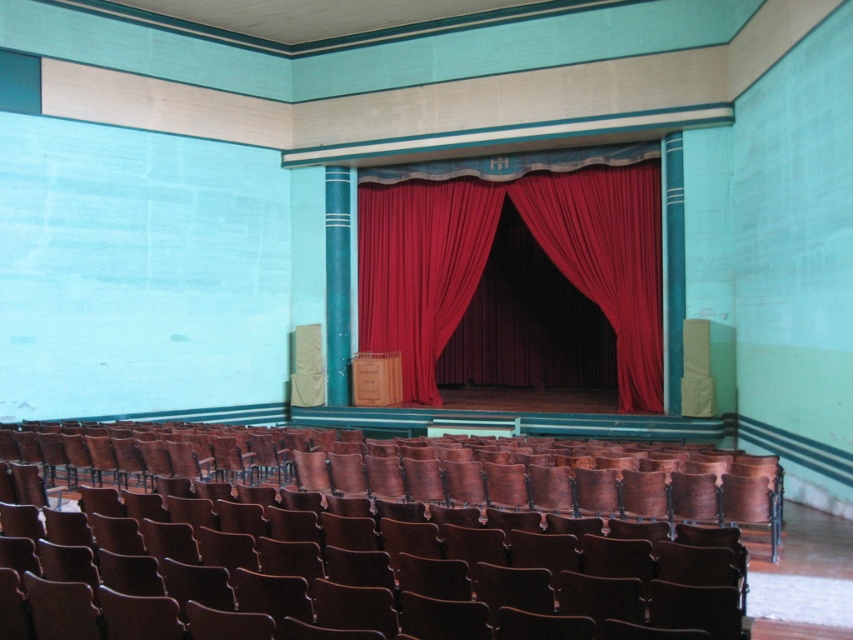
Is the position of wooden polished chair at lower center less distant than that of red velvet curtain at center?

Yes, wooden polished chair at lower center is in front of red velvet curtain at center.

Image resolution: width=853 pixels, height=640 pixels. Describe the element at coordinates (396, 547) in the screenshot. I see `wooden polished chair at lower center` at that location.

Identify the location of wooden polished chair at lower center. This screenshot has width=853, height=640. (396, 547).